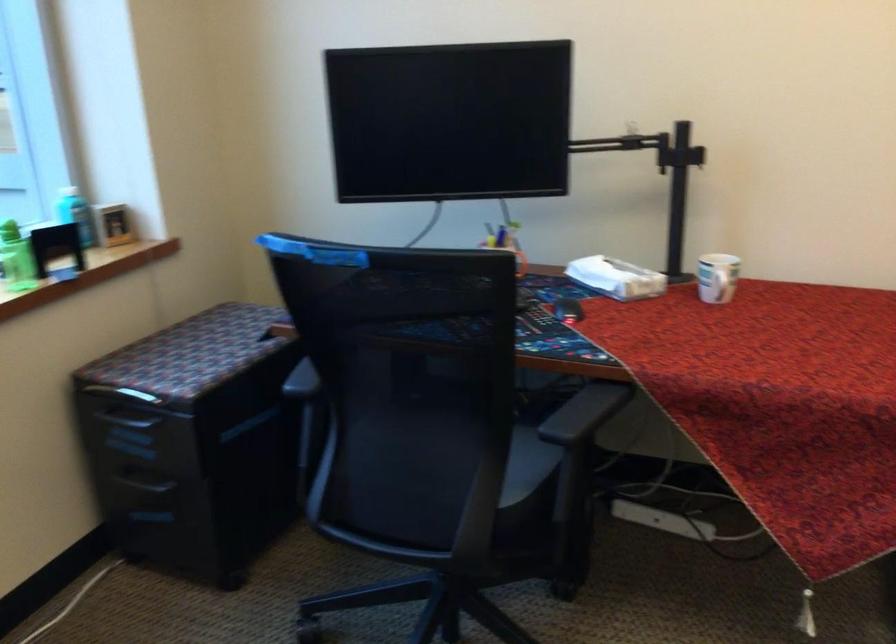
Find where to sit the chair sitting surface. Please return your answer as a coordinate pair (x, y).

(527, 465)